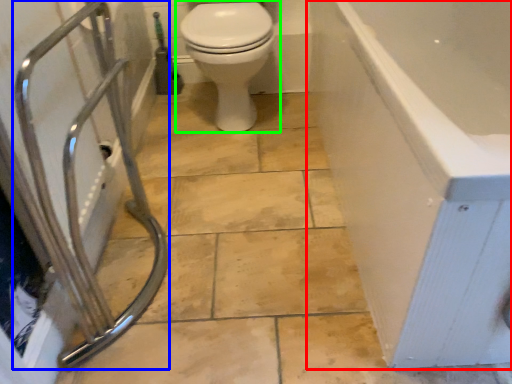
Question: Which object is the farthest from bathtub (highlighted by a red box)? Choose among these: shower (highlighted by a blue box) or toilet (highlighted by a green box).

Choices:
 (A) shower
 (B) toilet

Answer: (A)